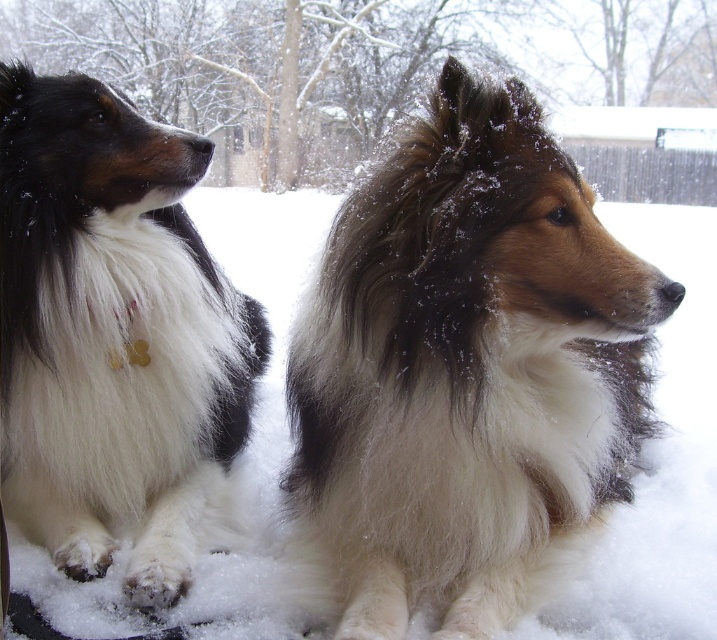
You are a photographer trying to capture a closeup of the fluffy white dog at center and the fluffy white dog at left. Which dog should you focus on first to ensure the subject is in focus?

You should focus on the fluffy white dog at center first because it is closer to the viewer, making it the primary subject for the closeup.

You are standing at the origin point in the image. Which direction should you move to reach the fluffy white dog at center?

The fluffy white dog at center is located at coordinates 0.580 on the x axis and 0.650 on the y axis. To reach it from the origin, move right along the x axis and up along the y axis.